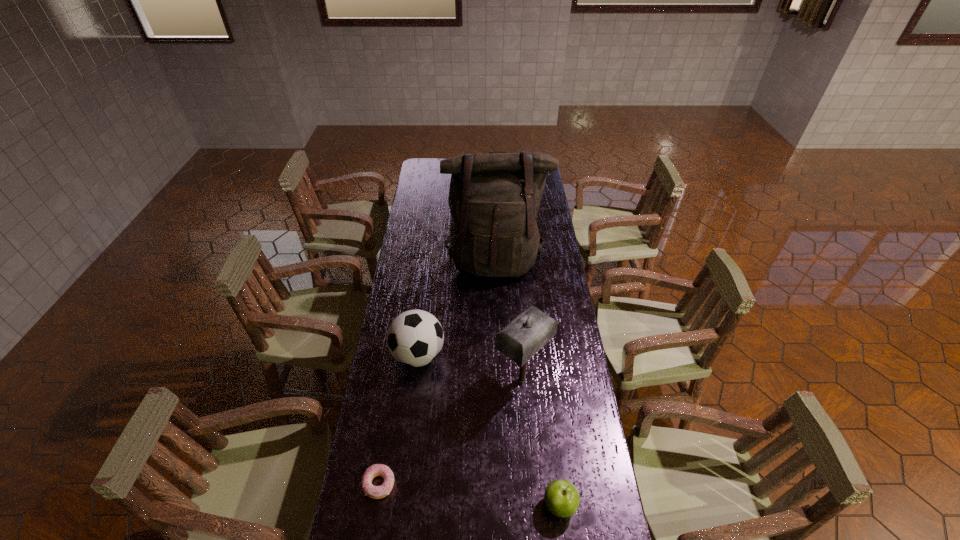
This screenshot has width=960, height=540. What are the coordinates of `free spot that satisfies the following two spatial constraints: 1. on the back side of the doughnut; 2. on the right side of the fourth shortest object` in the screenshot? It's located at (396, 380).

Find the location of a particular element. The height and width of the screenshot is (540, 960). free space that satisfies the following two spatial constraints: 1. on the front side of the mallet; 2. on the left side of the fourth tallest object is located at coordinates (531, 504).